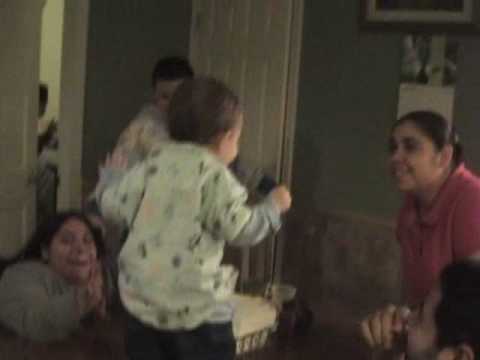
At what (x,y) coordinates should I click in order to perform the action: click on adjacent room. Please return your answer as a coordinate pair (x, y). Looking at the image, I should click on (50, 68).